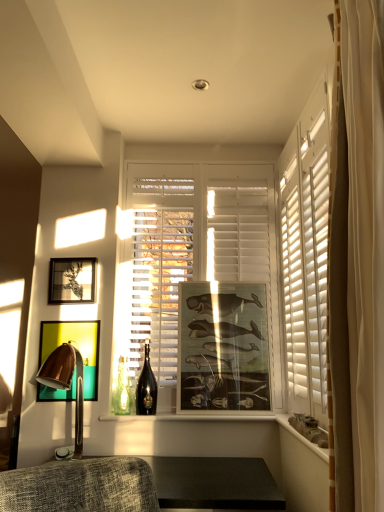
The image size is (384, 512). What are the coordinates of `vacant space situated above white glossy window sill at center (from a real-world perspective)` in the screenshot? It's located at (217, 411).